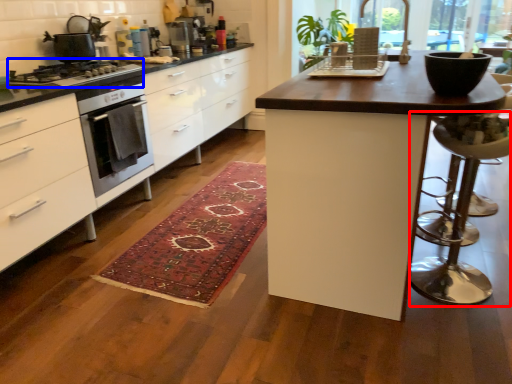
Question: Which object is further to the camera taking this photo, bar stool (highlighted by a red box) or gas stove (highlighted by a blue box)?

Choices:
 (A) bar stool
 (B) gas stove

Answer: (B)